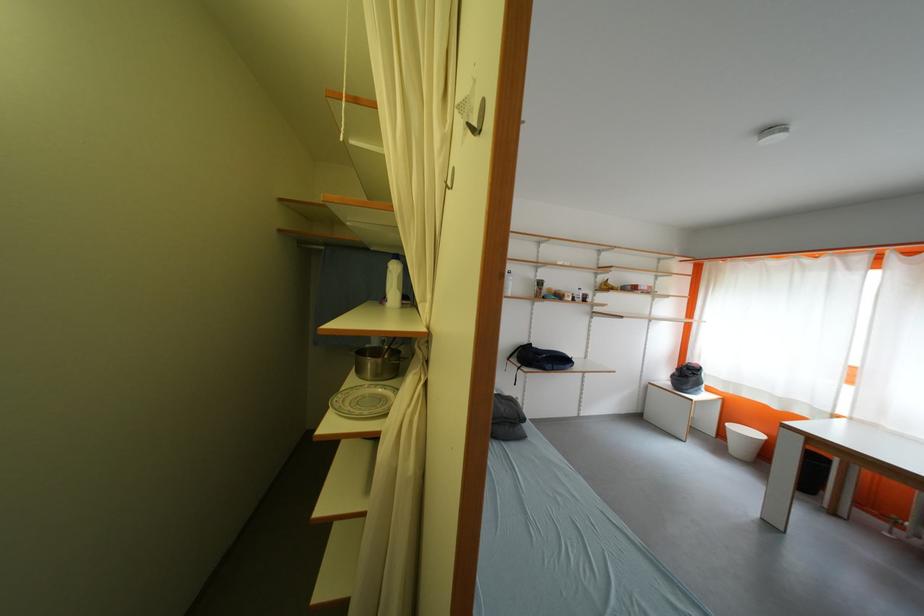
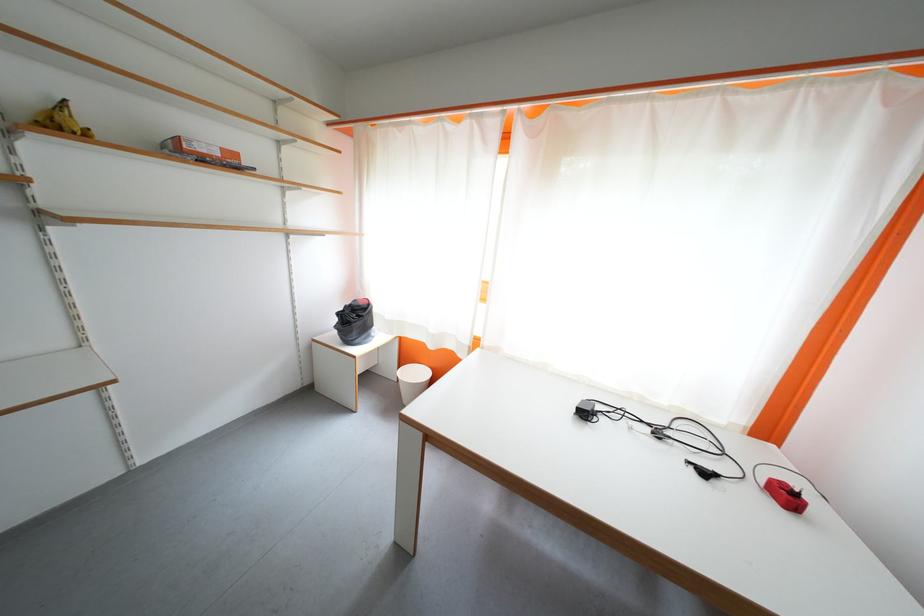
Where in the second image is the point corresponding to point 784,411 from the first image?

(440, 350)